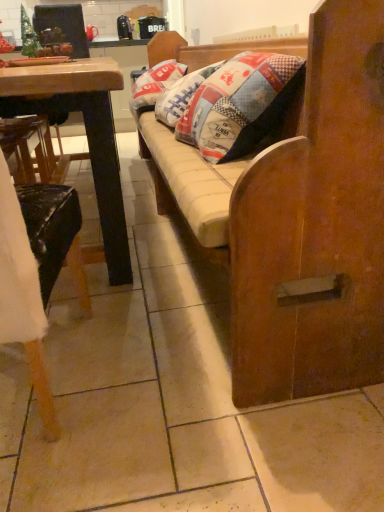
Question: Is wooden chair at left bigger than wooden studio couch at center?

Choices:
 (A) yes
 (B) no

Answer: (B)

Question: Is wooden chair at left facing away from wooden studio couch at center?

Choices:
 (A) no
 (B) yes

Answer: (A)

Question: Can you confirm if wooden chair at left is thinner than wooden studio couch at center?

Choices:
 (A) no
 (B) yes

Answer: (A)

Question: Considering the relative sizes of wooden chair at left and wooden studio couch at center in the image provided, is wooden chair at left shorter than wooden studio couch at center?

Choices:
 (A) no
 (B) yes

Answer: (B)

Question: Does wooden chair at left lie behind wooden studio couch at center?

Choices:
 (A) yes
 (B) no

Answer: (B)

Question: From a real-world perspective, is green matte christmas tree at upper left physically located above or below wooden chair at left?

Choices:
 (A) below
 (B) above

Answer: (B)

Question: From the image's perspective, is green matte christmas tree at upper left located above or below wooden chair at left?

Choices:
 (A) below
 (B) above

Answer: (B)

Question: Is point (21, 35) positioned closer to the camera than point (33, 262)?

Choices:
 (A) farther
 (B) closer

Answer: (A)

Question: Based on their sizes in the image, would you say green matte christmas tree at upper left is bigger or smaller than wooden chair at left?

Choices:
 (A) small
 (B) big

Answer: (A)

Question: Does point (145, 106) appear closer or farther from the camera than point (238, 269)?

Choices:
 (A) closer
 (B) farther

Answer: (B)

Question: Is patchwork fabric pillow at center bigger or smaller than wooden studio couch at center?

Choices:
 (A) big
 (B) small

Answer: (B)

Question: From a real-world perspective, is patchwork fabric pillow at center above or below wooden studio couch at center?

Choices:
 (A) below
 (B) above

Answer: (B)

Question: Would you say patchwork fabric pillow at center is to the left or to the right of wooden studio couch at center in the picture?

Choices:
 (A) right
 (B) left

Answer: (B)

Question: Is wooden chair at left to the left or to the right of green matte christmas tree at upper left in the image?

Choices:
 (A) right
 (B) left

Answer: (A)

Question: Looking at their shapes, would you say wooden chair at left is wider or thinner than green matte christmas tree at upper left?

Choices:
 (A) thin
 (B) wide

Answer: (B)